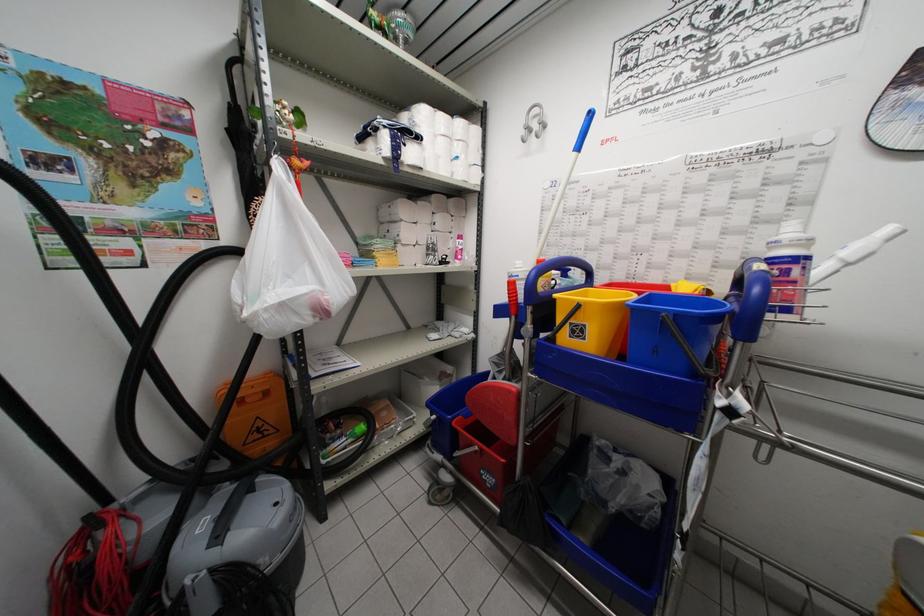
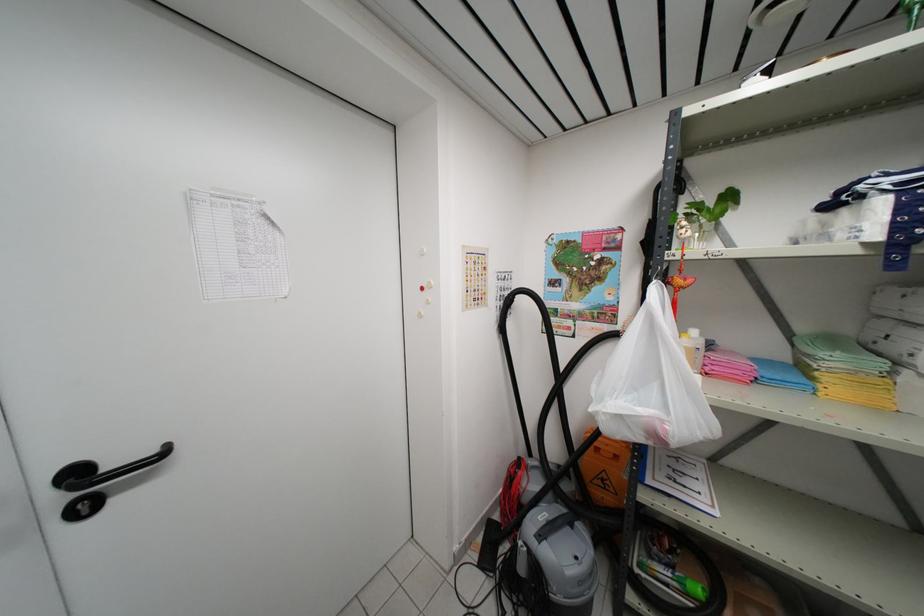
Where in the second image is the point corresponding to point (237, 490) from the first image?

(566, 515)